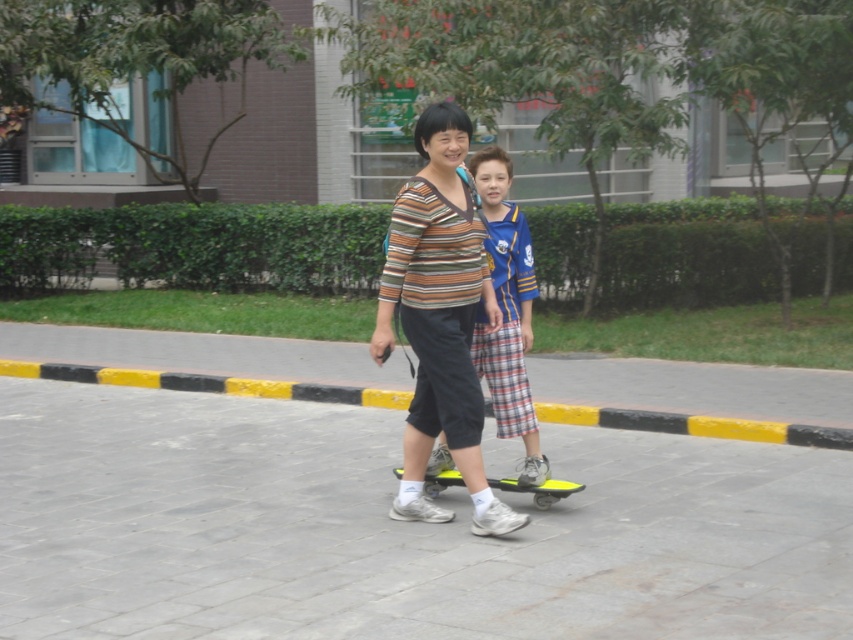
Question: Is yellow/black striped curb at lower center to the left of yellow matte skateboard at center from the viewer's perspective?

Choices:
 (A) no
 (B) yes

Answer: (A)

Question: Among these objects, which one is nearest to the camera?

Choices:
 (A) yellow/black striped curb at lower center
 (B) plaid cotton pants at center

Answer: (B)

Question: Can you confirm if yellow rubber mat at center is wider than striped fabric shirt at center?

Choices:
 (A) no
 (B) yes

Answer: (B)

Question: Which is farther from the yellow matte skateboard at center?

Choices:
 (A) striped fabric shirt at center
 (B) plaid cotton pants at center
 (C) yellow/black striped curb at lower center

Answer: (C)

Question: Is striped fabric shirt at center thinner than plaid cotton pants at center?

Choices:
 (A) yes
 (B) no

Answer: (B)

Question: Which object appears closest to the camera in this image?

Choices:
 (A) plaid cotton pants at center
 (B) yellow/black striped curb at lower center
 (C) yellow matte skateboard at center
 (D) striped fabric shirt at center

Answer: (D)